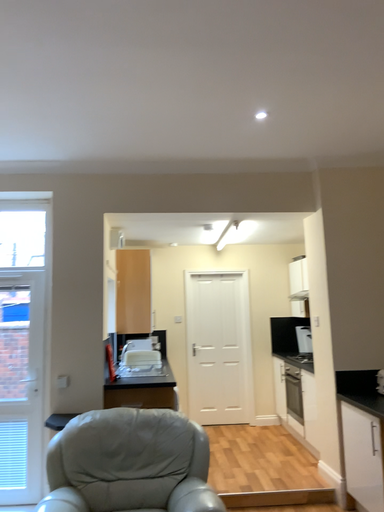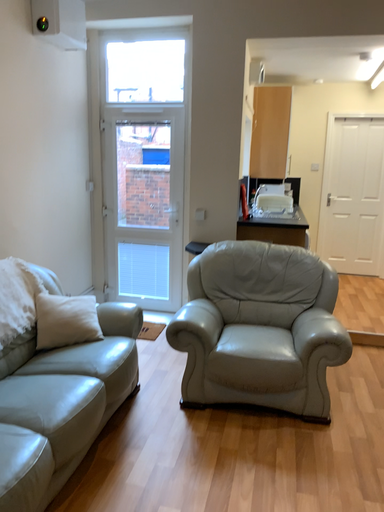
Question: How did the camera likely rotate when shooting the video?

Choices:
 (A) rotated downward
 (B) rotated upward

Answer: (A)